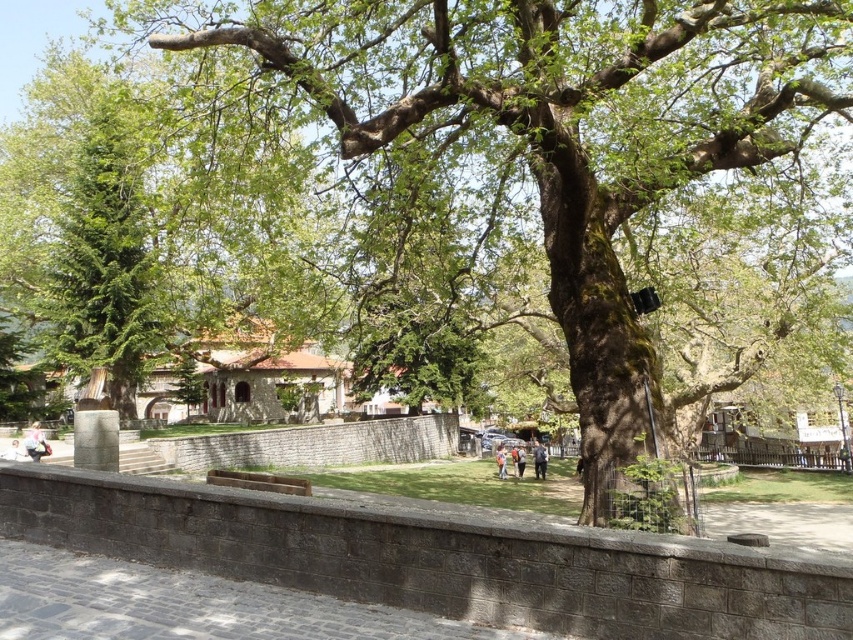
Question: Based on their relative distances, which object is farther from the gray cobblestone pavement at lower left?

Choices:
 (A) light brown wooden bench at lower left
 (B) gray concrete pavement at lower right

Answer: (A)

Question: Is gray cobblestone pavement at lower left further to camera compared to light brown wooden bench at lower left?

Choices:
 (A) no
 (B) yes

Answer: (A)

Question: Does gray cobblestone pavement at lower left come in front of light brown wooden bench at lower left?

Choices:
 (A) yes
 (B) no

Answer: (A)

Question: Which object is farther from the camera taking this photo?

Choices:
 (A) light brown wooden bench at lower left
 (B) dark brown leather jacket at center

Answer: (B)

Question: Is gray concrete pavement at lower right above dark brown leather jacket at center?

Choices:
 (A) yes
 (B) no

Answer: (A)

Question: Which is farther from the light brown wooden bench at lower left?

Choices:
 (A) gray cobblestone pavement at lower left
 (B) orange fabric bag at center

Answer: (B)